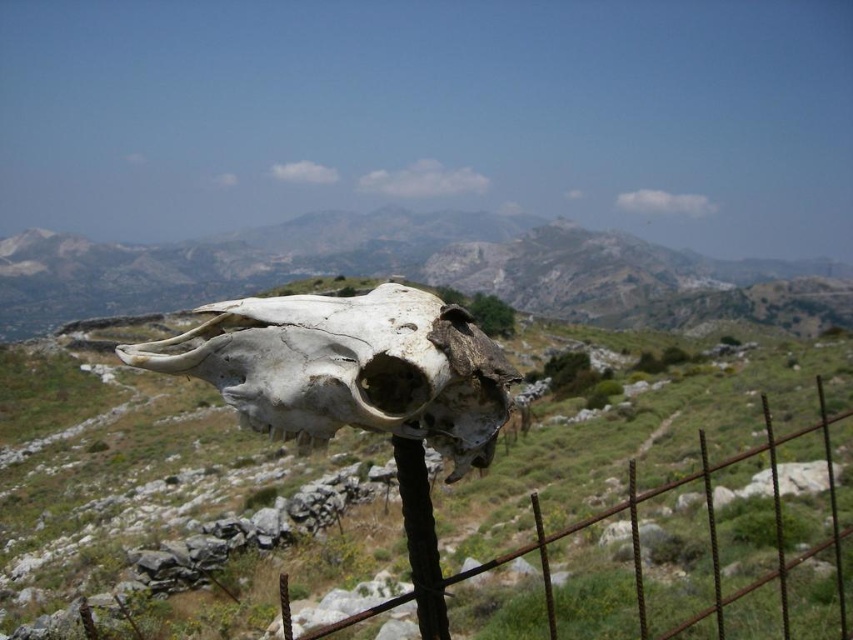
You are a hiker planning to take a photo of the gray rocky mountain at center and the rusty metal fence at center from a distance. Which object will appear larger in the photo?

The gray rocky mountain at center will appear larger in the photo because it is much taller than the rusty metal fence at center.